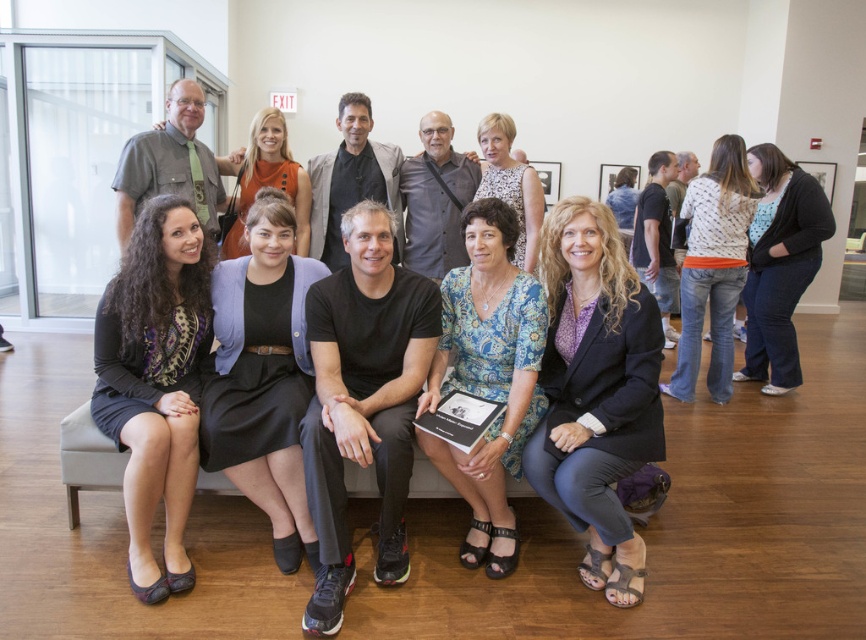
This screenshot has width=866, height=640. Find the location of `matte black dress at lower left`. matte black dress at lower left is located at coordinates (154, 381).

Is point (128, 353) farther from camera compared to point (735, 273)?

No, (128, 353) is in front of (735, 273).

Where is `matte black dress at lower left`? The height and width of the screenshot is (640, 866). matte black dress at lower left is located at coordinates (154, 381).

In the scene shown: Is matte gray shirt at upper left positioned behind blonde hair at center?

No.

Is matte gray shirt at upper left smaller than blonde hair at center?

Correct, matte gray shirt at upper left occupies less space than blonde hair at center.

Who is more forward, (175,179) or (625,182)?

Positioned in front is point (175,179).

Identify the location of matte gray shirt at upper left. (171, 163).

From the picture: Who is more distant from viewer, (295, 532) or (477, 237)?

Positioned behind is point (295, 532).

Does point (279, 369) come behind point (474, 275)?

Yes, it is behind point (474, 275).

Is point (285, 412) closer to viewer compared to point (472, 337)?

That is True.

Locate an element on the screen. The height and width of the screenshot is (640, 866). black fabric dress at center is located at coordinates (263, 378).